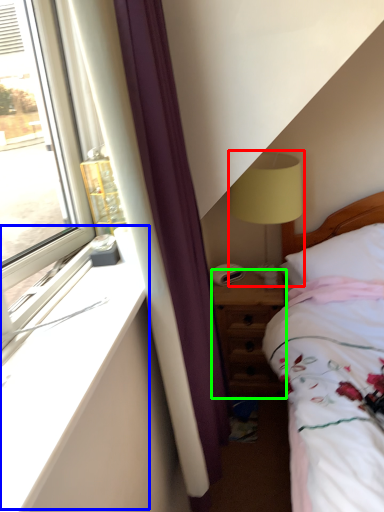
Question: Estimate the real-world distances between objects in this image. Which object is closer to table lamp (highlighted by a red box), window sill (highlighted by a blue box) or nightstand (highlighted by a green box)?

Choices:
 (A) window sill
 (B) nightstand

Answer: (B)